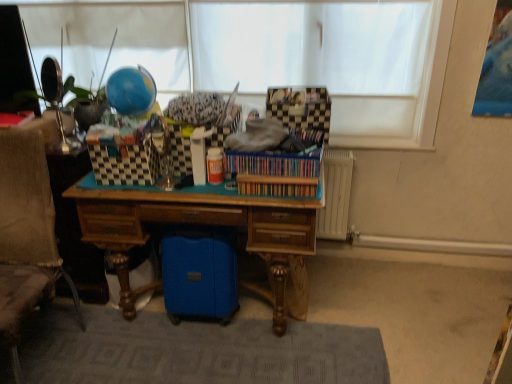
Describe the element at coordinates (274, 163) in the screenshot. This screenshot has height=384, width=512. I see `multicolored cardboard box at center, the first book from the top` at that location.

In order to face textured beige fabric swivel chair at left, should I rotate leftwards or rightwards?

Rotate your view left by about 31.714°.

Image resolution: width=512 pixels, height=384 pixels. I want to click on wooden bookshelf at center, which appears as the second book when viewed from the top, so click(x=276, y=186).

From a real-world perspective, between multicolored cardboard box at center, which appears as the 2th book when ordered from the bottom, and gray textured rug at lower center, who is vertically higher?

From a 3D spatial view, multicolored cardboard box at center, which appears as the 2th book when ordered from the bottom, is above.

Is there a large distance between multicolored cardboard box at center, the first book from the top, and gray textured rug at lower center?

No, multicolored cardboard box at center, the first book from the top, is in close proximity to gray textured rug at lower center.

Does point (296, 157) come behind point (298, 363)?

No, (296, 157) is closer to viewer.

Between multicolored cardboard box at center, the first book from the top, and gray textured rug at lower center, which one has larger size?

With larger size is gray textured rug at lower center.

Is wooden desk at center taller than wooden bookshelf at center, the first book positioned from the bottom?

Correct, wooden desk at center is much taller as wooden bookshelf at center, the first book positioned from the bottom.

From the image's perspective, is wooden desk at center positioned above or below wooden bookshelf at center, the first book positioned from the bottom?

wooden desk at center is situated lower than wooden bookshelf at center, the first book positioned from the bottom, in the image.

Which of these two, wooden desk at center or wooden bookshelf at center, the first book positioned from the bottom, is smaller?

Smaller between the two is wooden bookshelf at center, the first book positioned from the bottom.

Looking at this image, are multicolored cardboard box at center, the first book from the top, and checkerboard-patterned fabric at upper center far apart?

Actually, multicolored cardboard box at center, the first book from the top, and checkerboard-patterned fabric at upper center are a little close together.

From the image's perspective, which one is positioned higher, multicolored cardboard box at center, which appears as the 2th book when ordered from the bottom, or checkerboard-patterned fabric at upper center?

checkerboard-patterned fabric at upper center is shown above in the image.

Is multicolored cardboard box at center, the first book from the top, situated inside checkerboard-patterned fabric at upper center or outside?

multicolored cardboard box at center, the first book from the top, is spatially situated outside checkerboard-patterned fabric at upper center.

Relative to checkerboard-patterned fabric at upper center, is multicolored cardboard box at center, which appears as the 2th book when ordered from the bottom, in front or behind?

multicolored cardboard box at center, which appears as the 2th book when ordered from the bottom, is positioned closer to the viewer than checkerboard-patterned fabric at upper center.

You are a GUI agent. You are given a task and a screenshot of the screen. Output one action in this format:
    pyautogui.click(x=<x>, y=<y>)
    Task: Click on the storage box behind the wooden bookshelf at center, which appears as the second book when viewed from the top
    The width and height of the screenshot is (512, 384).
    Given the screenshot: What is the action you would take?
    pyautogui.click(x=300, y=107)

From the image's perspective, is checkerboard-patterned fabric at upper center on top of wooden bookshelf at center, the first book positioned from the bottom?

Yes, from the image's perspective, checkerboard-patterned fabric at upper center is above wooden bookshelf at center, the first book positioned from the bottom.

Can you confirm if checkerboard-patterned fabric at upper center is shorter than wooden bookshelf at center, the first book positioned from the bottom?

No.

Does textured beige fabric swivel chair at left have a smaller size compared to wooden desk at center?

Yes, textured beige fabric swivel chair at left is smaller than wooden desk at center.

Measure the distance between textured beige fabric swivel chair at left and wooden desk at center.

A distance of 18.61 inches exists between textured beige fabric swivel chair at left and wooden desk at center.

Is textured beige fabric swivel chair at left facing away from wooden desk at center?

That's right, textured beige fabric swivel chair at left is facing away from wooden desk at center.

From a real-world perspective, is textured beige fabric swivel chair at left above or below wooden bookshelf at center, the first book positioned from the bottom?

Clearly, from a real-world perspective, textured beige fabric swivel chair at left is below wooden bookshelf at center, the first book positioned from the bottom.

In the scene shown: Considering the sizes of textured beige fabric swivel chair at left and wooden bookshelf at center, the first book positioned from the bottom, in the image, is textured beige fabric swivel chair at left bigger or smaller than wooden bookshelf at center, the first book positioned from the bottom,?

Considering their sizes, textured beige fabric swivel chair at left takes up more space than wooden bookshelf at center, the first book positioned from the bottom.

Which is more to the right, textured beige fabric swivel chair at left or wooden bookshelf at center, the first book positioned from the bottom?

wooden bookshelf at center, the first book positioned from the bottom, is more to the right.

From the image's perspective, who appears lower, wooden bookshelf at center, the first book positioned from the bottom, or checkerboard-patterned fabric at upper center?

wooden bookshelf at center, the first book positioned from the bottom, appears lower in the image.

Measure the distance between wooden bookshelf at center, the first book positioned from the bottom, and checkerboard-patterned fabric at upper center.

They are 14.35 inches apart.

Would you say wooden bookshelf at center, the first book positioned from the bottom, is inside or outside checkerboard-patterned fabric at upper center?

wooden bookshelf at center, the first book positioned from the bottom, lies outside checkerboard-patterned fabric at upper center.

Locate an element on the screen. The width and height of the screenshot is (512, 384). doormat below the multicolored cardboard box at center, the first book from the top (from a real-world perspective) is located at coordinates (195, 351).

From the image's perspective, which book is the 1st one above the wooden desk at center? Please provide its 2D coordinates.

[(276, 186)]

Considering their positions, is gray textured rug at lower center positioned closer to checkerboard-patterned fabric at upper center than wooden bookshelf at center, the first book positioned from the bottom?

wooden bookshelf at center, the first book positioned from the bottom, is closer to checkerboard-patterned fabric at upper center.

In the scene shown: Which object lies nearer to the anchor point white sheer fabric at upper center, multicolored cardboard box at center, the first book from the top, or textured beige fabric swivel chair at left?

multicolored cardboard box at center, the first book from the top, is positioned closer to the anchor white sheer fabric at upper center.

Consider the image. From the image, which object appears to be nearer to wooden bookshelf at center, the first book positioned from the bottom, checkerboard-patterned fabric at upper center or wooden desk at center?

wooden desk at center.

From the picture: When comparing their distances from multicolored cardboard box at center, the first book from the top, does textured beige fabric swivel chair at left or gray textured rug at lower center seem closer?

Among the two, gray textured rug at lower center is located nearer to multicolored cardboard box at center, the first book from the top.

Which object lies further to the anchor point gray textured rug at lower center, textured beige fabric swivel chair at left or checkerboard-patterned fabric at upper center?

Based on the image, checkerboard-patterned fabric at upper center appears to be further to gray textured rug at lower center.

Which object lies further to the anchor point textured beige fabric swivel chair at left, gray textured rug at lower center or multicolored cardboard box at center, which appears as the 2th book when ordered from the bottom?

Based on the image, multicolored cardboard box at center, which appears as the 2th book when ordered from the bottom, appears to be further to textured beige fabric swivel chair at left.

When comparing their distances from checkerboard-patterned fabric at upper center, does wooden desk at center or wooden bookshelf at center, which appears as the second book when viewed from the top, seem closer?

wooden bookshelf at center, which appears as the second book when viewed from the top.

When comparing their distances from wooden desk at center, does checkerboard-patterned fabric at upper center or wooden bookshelf at center, the first book positioned from the bottom, seem further?

checkerboard-patterned fabric at upper center lies further to wooden desk at center than the other object.

Where is `doormat situated between textured beige fabric swivel chair at left and wooden desk at center from left to right`? The height and width of the screenshot is (384, 512). doormat situated between textured beige fabric swivel chair at left and wooden desk at center from left to right is located at coordinates 195,351.

The image size is (512, 384). Find the location of `desk between wooden bookshelf at center, which appears as the second book when viewed from the top, and gray textured rug at lower center vertically`. desk between wooden bookshelf at center, which appears as the second book when viewed from the top, and gray textured rug at lower center vertically is located at coordinates (206, 224).

This screenshot has height=384, width=512. I want to click on storage box between white sheer fabric at upper center and gray textured rug at lower center in the vertical direction, so click(x=300, y=107).

The height and width of the screenshot is (384, 512). In order to click on doormat between textured beige fabric swivel chair at left and checkerboard-patterned fabric at upper center from left to right in this screenshot , I will do `click(195, 351)`.